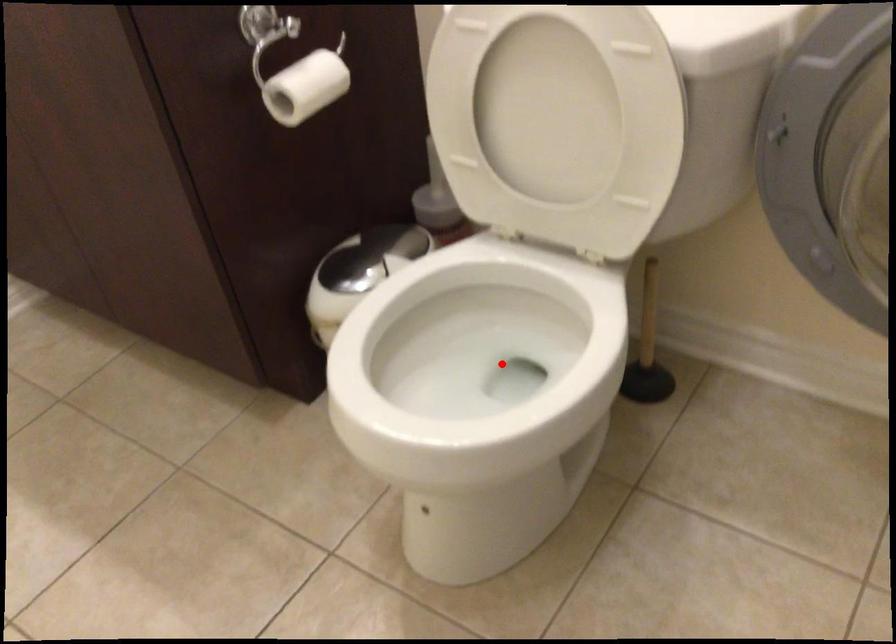
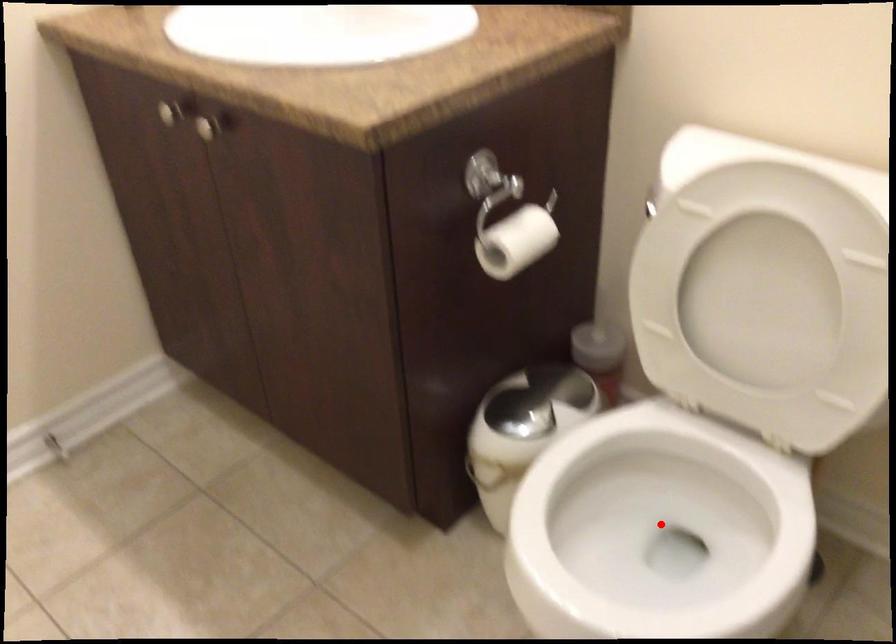
I am providing you with two images of the same scene from different viewpoints. A red point is marked on the first image and another point is marked on the second image. Is the red point in image1 aligned with the point shown in image2?

Yes